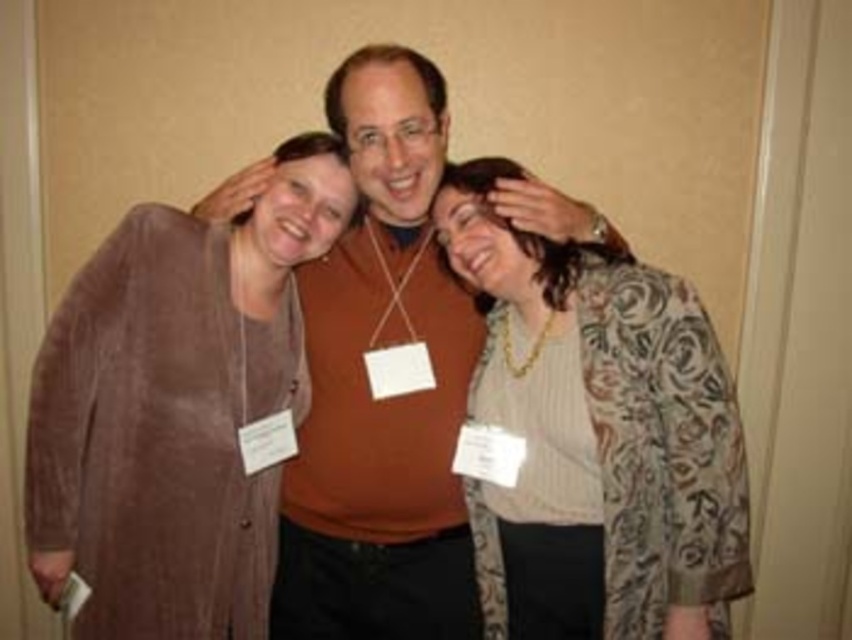
You are a photographer setting up for a group photo. You notice the matte brown cardigan at left and the patterned silk blouse at center. Which clothing item is closer to the camera?

The patterned silk blouse at center is behind the matte brown cardigan at left, so the matte brown cardigan at left is closer to the camera.

Based on the photo, you are a photographer trying to adjust the lighting for a group photo. You notice two items in the scene that are both matte brown in color. Which one is closer to the camera, the matte brown cardigan at left or the matte brown sweater at center?

The matte brown cardigan at left is closer to the camera because it is in front of the matte brown sweater at center.